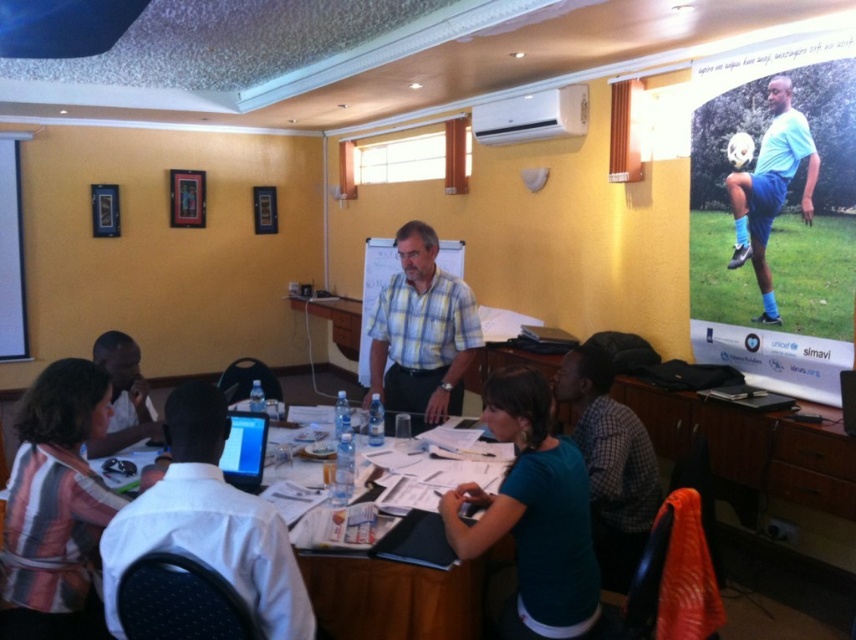
Question: Does plaid fabric shirt at center appear under white plastic air conditioner at upper center?

Choices:
 (A) yes
 (B) no

Answer: (A)

Question: Which of these objects is positioned farthest from the matte black laptop at left?

Choices:
 (A) teal fabric shirt at center
 (B) teal fabric shirt at lower center
 (C) blue matte soccer player at upper right

Answer: (C)

Question: Which of the following is the closest to the observer?

Choices:
 (A) (494, 404)
 (B) (123, 356)
 (C) (467, 342)

Answer: (A)

Question: Which point is farther from the camera taking this photo?

Choices:
 (A) (64, 387)
 (B) (557, 570)

Answer: (A)

Question: Is wooden table at center to the right of plaid fabric shirt at center from the viewer's perspective?

Choices:
 (A) no
 (B) yes

Answer: (A)

Question: Does wooden table at center have a smaller size compared to plaid fabric shirt at center?

Choices:
 (A) yes
 (B) no

Answer: (A)